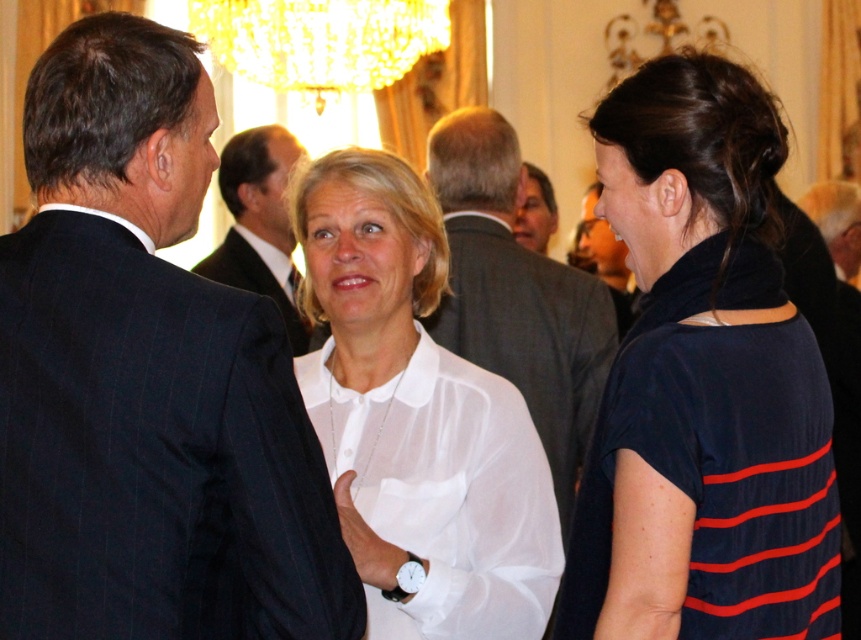
Is dark blue pinstripe suit at center positioned at the back of dark blue suit at center?

No, dark blue pinstripe suit at center is in front of dark blue suit at center.

In the scene shown: Is dark blue pinstripe suit at center thinner than dark blue suit at center?

Indeed, dark blue pinstripe suit at center has a lesser width compared to dark blue suit at center.

Which is behind, point (206, 280) or point (276, 145)?

The point (276, 145) is behind.

Locate an element on the screen. dark blue pinstripe suit at center is located at coordinates (147, 380).

Does dark blue pinstripe suit at center lie behind dark blue striped shirt at right?

No.

Can you confirm if dark blue pinstripe suit at center is bigger than dark blue striped shirt at right?

Correct, dark blue pinstripe suit at center is larger in size than dark blue striped shirt at right.

Locate an element on the screen. The width and height of the screenshot is (861, 640). dark blue pinstripe suit at center is located at coordinates (147, 380).

Is dark blue pinstripe suit at center shorter than gray suit jacket at center?

No.

Does dark blue pinstripe suit at center have a larger size compared to gray suit jacket at center?

No.

What do you see at coordinates (147, 380) in the screenshot? I see `dark blue pinstripe suit at center` at bounding box center [147, 380].

This screenshot has width=861, height=640. What are the coordinates of `dark blue pinstripe suit at center` in the screenshot? It's located at (147, 380).